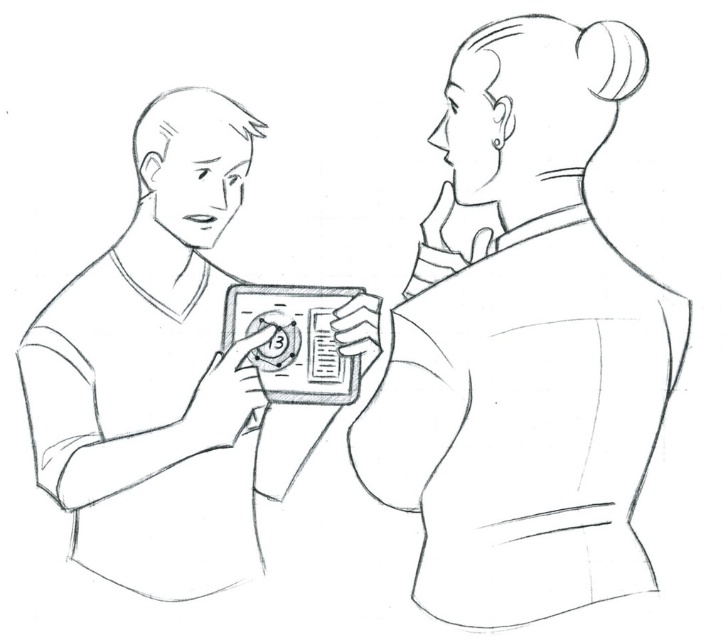
Question: Is smooth fabric blouse at upper right below matte black device at center?

Choices:
 (A) no
 (B) yes

Answer: (A)

Question: Is smooth fabric blouse at upper right wider than matte black device at center?

Choices:
 (A) no
 (B) yes

Answer: (A)

Question: Considering the relative positions of smooth fabric blouse at upper right and matte black device at center in the image provided, where is smooth fabric blouse at upper right located with respect to matte black device at center?

Choices:
 (A) below
 (B) above

Answer: (B)